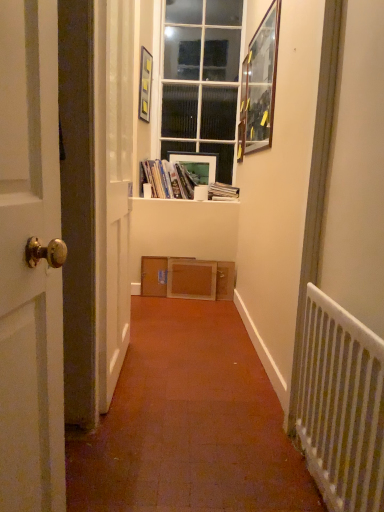
Measure the distance between point (270, 38) and camera.

Point (270, 38) is 2.38 meters from camera.

What are the coordinates of `matte glass picture frame at upper center, the second picture frame when ordered from back to front` in the screenshot? It's located at (145, 84).

Image resolution: width=384 pixels, height=512 pixels. What do you see at coordinates (145, 84) in the screenshot?
I see `matte glass picture frame at upper center, the second picture frame when ordered from back to front` at bounding box center [145, 84].

Identify the location of hardcover book at center. (222, 192).

This screenshot has width=384, height=512. What are the coordinates of `transparent glass screen door at left` in the screenshot? It's located at (116, 195).

Where is `wooden at center`? The width and height of the screenshot is (384, 512). wooden at center is located at coordinates (186, 278).

In terms of width, does hardcover book at center look wider or thinner when compared to white cardboard at center?

Considering their sizes, hardcover book at center looks slimmer than white cardboard at center.

How different are the orientations of hardcover book at center and white cardboard at center in degrees?

hardcover book at center and white cardboard at center are facing 1.54 degrees away from each other.

Consider the image. Which is closer, (213, 192) or (137, 198)?

The point (137, 198) is closer to the camera.

From a real-world perspective, is hardcover book at center positioned above or below white cardboard at center?

Clearly, from a real-world perspective, hardcover book at center is above white cardboard at center.

How many degrees apart are the facing directions of white cardboard at center and white metal radiator at right?

88.6 degrees separate the facing orientations of white cardboard at center and white metal radiator at right.

Measure the distance from white cardboard at center to white metal radiator at right.

2.31 meters.

Considering the sizes of objects white cardboard at center and white metal radiator at right in the image provided, who is wider, white cardboard at center or white metal radiator at right?

With larger width is white cardboard at center.

From a real-world perspective, which is physically above, white cardboard at center or white metal radiator at right?

From a 3D spatial view, white cardboard at center is above.

Is hardcover book at center touching white metal radiator at right?

hardcover book at center and white metal radiator at right are not in contact.

How much distance is there between hardcover book at center and white metal radiator at right?

7.55 feet.

Can we say hardcover book at center lies outside white metal radiator at right?

hardcover book at center is positioned outside white metal radiator at right.

Who is more distant, hardcover book at center or white metal radiator at right?

Positioned behind is hardcover book at center.

Is there a large distance between white metal radiator at right and matte white picture frame at center, placed as the 1th picture frame when sorted from back to front?

Yes, white metal radiator at right is far from matte white picture frame at center, placed as the 1th picture frame when sorted from back to front.

Which of these two, white metal radiator at right or matte white picture frame at center, which ranks as the second picture frame in left-to-right order, stands shorter?

matte white picture frame at center, which ranks as the second picture frame in left-to-right order.

Based on the photo, is white metal radiator at right inside the boundaries of matte white picture frame at center, placed as the 3th picture frame when sorted from front to back, or outside?

white metal radiator at right is located beyond the bounds of matte white picture frame at center, placed as the 3th picture frame when sorted from front to back.

In terms of size, does white glass window at center appear bigger or smaller than matte plastic books at center?

In the image, white glass window at center appears to be larger than matte plastic books at center.

Is the position of white glass window at center less distant than that of matte plastic books at center?

That is False.

Between white glass window at center and matte plastic books at center, which one has more height?

white glass window at center.

Is matte glass picture frame at upper center, the second picture frame when ordered from back to front, not close to transparent glass screen door at left?

matte glass picture frame at upper center, the second picture frame when ordered from back to front, is positioned a significant distance from transparent glass screen door at left.

How different are the orientations of matte glass picture frame at upper center, the second picture frame when ordered from back to front, and transparent glass screen door at left in degrees?

11.9 degrees.

Is matte glass picture frame at upper center, the second picture frame positioned from the front, wider or thinner than transparent glass screen door at left?

matte glass picture frame at upper center, the second picture frame positioned from the front, is thinner than transparent glass screen door at left.

Does matte glass picture frame at upper center, the second picture frame when ordered from back to front, contain transparent glass screen door at left?

No, matte glass picture frame at upper center, the second picture frame when ordered from back to front, does not contain transparent glass screen door at left.

Would you say white glass window at center is outside white metal radiator at right?

white glass window at center lies outside white metal radiator at right's area.

Relative to white metal radiator at right, is white glass window at center in front or behind?

In the image, white glass window at center appears behind white metal radiator at right.

Does white glass window at center appear on the right side of white metal radiator at right?

Incorrect, white glass window at center is not on the right side of white metal radiator at right.

Who is shorter, white glass window at center or white metal radiator at right?

With less height is white metal radiator at right.

Where is `paperback book on the right of white cardboard at center`? The width and height of the screenshot is (384, 512). paperback book on the right of white cardboard at center is located at coordinates tap(222, 192).

Find the location of a particular element. This screenshot has width=384, height=512. radiator that appears below the white cardboard at center (from the image's perspective) is located at coordinates (341, 406).

Estimate the real-world distances between objects in this image. Which object is closer to wooden-framed mirror at upper right, the 3th picture frame when ordered from back to front, matte white picture frame at center, which ranks as the second picture frame in left-to-right order, or matte glass picture frame at upper center, the 1th picture frame in the left-to-right sequence?

matte white picture frame at center, which ranks as the second picture frame in left-to-right order, is closer to wooden-framed mirror at upper right, the 3th picture frame when ordered from back to front.

Which object lies further to the anchor point white cardboard at center, matte glass picture frame at upper center, the second picture frame when ordered from back to front, or matte plastic books at center?

matte glass picture frame at upper center, the second picture frame when ordered from back to front, is further to white cardboard at center.

When comparing their distances from matte glass picture frame at upper center, the 1th picture frame in the left-to-right sequence, does matte white picture frame at center, placed as the 1th picture frame when sorted from back to front, or white glass window at center seem further?

Among the two, matte white picture frame at center, placed as the 1th picture frame when sorted from back to front, is located further to matte glass picture frame at upper center, the 1th picture frame in the left-to-right sequence.

Which object lies further to the anchor point wooden-framed mirror at upper right, the first picture frame viewed from the right, wooden at center or hardcover book at center?

wooden at center lies further to wooden-framed mirror at upper right, the first picture frame viewed from the right, than the other object.

Looking at the image, which one is located further to hardcover book at center, white wooden door at left or matte glass picture frame at upper center, the second picture frame when ordered from back to front?

white wooden door at left lies further to hardcover book at center than the other object.

Which object lies further to the anchor point matte plastic books at center, white metal radiator at right or white glass window at center?

white metal radiator at right.

Considering their positions, is matte glass picture frame at upper center, the second picture frame when ordered from back to front, positioned closer to white metal radiator at right than matte plastic books at center?

matte plastic books at center is closer to white metal radiator at right.

Considering their positions, is transparent glass screen door at left positioned closer to white cardboard at center than wooden at center?

Among the two, wooden at center is located nearer to white cardboard at center.

I want to click on shelf between white wooden door at left and matte white picture frame at center, which is counted as the second picture frame, starting from the right, along the z-axis, so click(186, 278).

Where is `book that lies between white glass window at center and wooden at center from top to bottom`? This screenshot has width=384, height=512. book that lies between white glass window at center and wooden at center from top to bottom is located at coordinates click(170, 179).

The width and height of the screenshot is (384, 512). Identify the location of window sill between wooden-framed mirror at upper right, placed as the third picture frame when sorted from left to right, and wooden at center, along the z-axis. (157, 200).

Find the location of `book between white wooden door at left and matte white picture frame at center, which is counted as the second picture frame, starting from the right, along the z-axis`. book between white wooden door at left and matte white picture frame at center, which is counted as the second picture frame, starting from the right, along the z-axis is located at coordinates (170, 179).